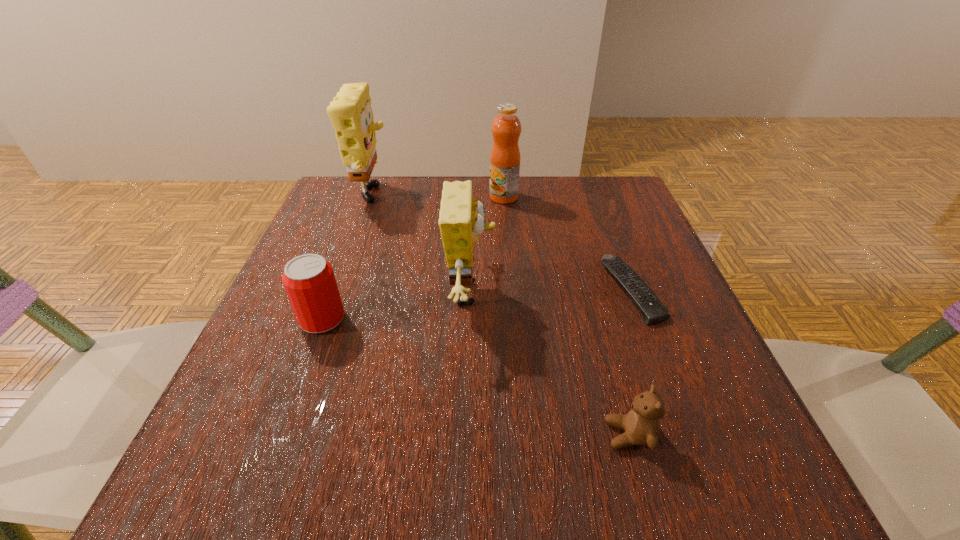
Identify the location of empty location between the beer can and the remote control. (477, 305).

Identify the location of vacant space that is in between the fourth tallest object and the right sponge. The image size is (960, 540). (396, 306).

Identify the location of vacant point located between the fruit juice and the remote control. (567, 244).

Where is `object that is the third closest to the fifth tallest object`? object that is the third closest to the fifth tallest object is located at coordinates (309, 281).

Identify which object is the closest to the shortest object. Please provide its 2D coordinates. Your answer should be formatted as a tuple, i.e. [(x, y)], where the tuple contains the x and y coordinates of a point satisfying the conditions above.

[(641, 425)]

This screenshot has width=960, height=540. Find the location of `free space that satisfies the following two spatial constraints: 1. on the front side of the shortest object; 2. on the face of the right sponge`. free space that satisfies the following two spatial constraints: 1. on the front side of the shortest object; 2. on the face of the right sponge is located at coordinates (633, 294).

Locate an element on the screen. The image size is (960, 540). vacant space that satisfies the following two spatial constraints: 1. on the front side of the shortest object; 2. on the face of the right sponge is located at coordinates (633, 294).

What are the coordinates of `blank space that satisfies the following two spatial constraints: 1. on the face of the farther sponge; 2. on the front side of the fourth tallest object` in the screenshot? It's located at (330, 319).

Where is `vacant space that satisfies the following two spatial constraints: 1. on the face of the left sponge; 2. on the right side of the rightmost object`? Image resolution: width=960 pixels, height=540 pixels. vacant space that satisfies the following two spatial constraints: 1. on the face of the left sponge; 2. on the right side of the rightmost object is located at coordinates (341, 290).